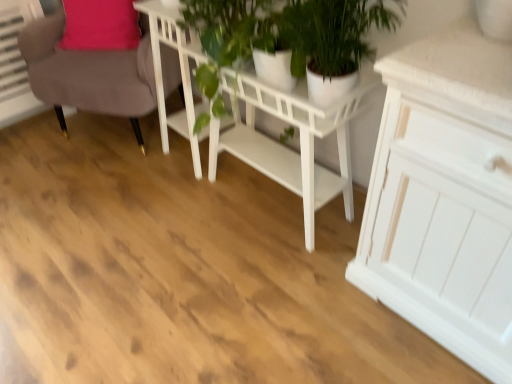
This screenshot has width=512, height=384. I want to click on vacant area in front of white glossy table at center, which is counted as the first table, starting from the right, so click(267, 290).